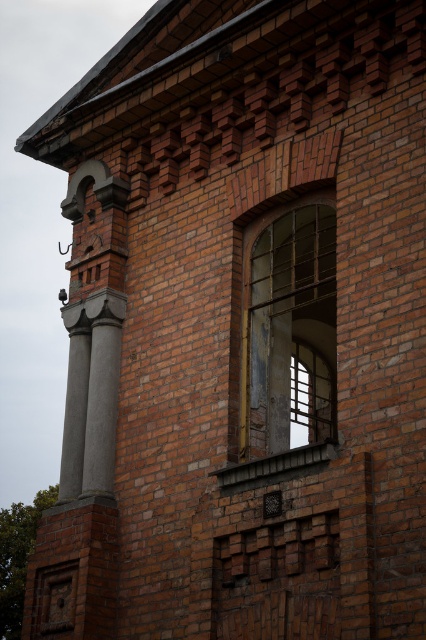
You are an architect designing a new pathway between the gray concrete column at left and the smooth concrete column at center. The pathway must be at least 8 feet wide to accommodate wheelchair access. Based on the image, can the existing space between these two columns support this requirement?

The gray concrete column at left and smooth concrete column at center are 9.04 feet apart, which exceeds the minimum 8 feet requirement. Therefore, the pathway can be constructed between them to meet accessibility standards.

From the picture: You are an architect reviewing a building facade. You notice the translucent glass window at center and the smooth concrete column at center. Which of these two elements is shorter in height?

The translucent glass window at center is shorter than the smooth concrete column at center in height.